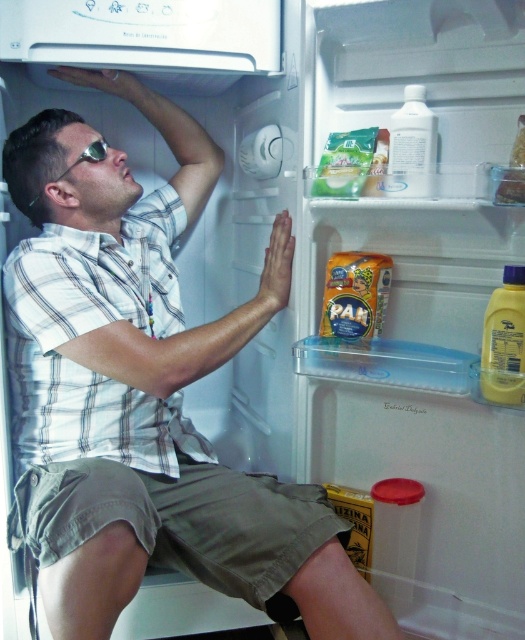
You are a person inside the refrigerator trying to grab the yellow plastic bottle at right and the translucent plastic container at upper right. Considering their positions, can you reach both items without moving your current position?

The yellow plastic bottle at right and the translucent plastic container at upper right are 9.29 inches apart from each other. Since the distance between them is relatively small, you might be able to reach both items without moving your current position, provided your arm can comfortably extend to both locations simultaneously.

The man is trying to reach the yellow plastic bottle at right. Based on the coordinates given, is the bottle located on the top shelf, second shelf, or third shelf?

The yellow plastic bottle at right is located at point (505,340). Since the top shelf has the highest y coordinate, the bottle is on the top shelf.

You are trying to grab the yellow plastic bottle at right and the translucent plastic container at upper right from inside the refrigerator. Considering their sizes, which one might require you to stretch more to reach?

The yellow plastic bottle at right has a larger size compared to the translucent plastic container at upper right, so you might need to stretch more to reach the yellow plastic bottle at right due to its bigger size.